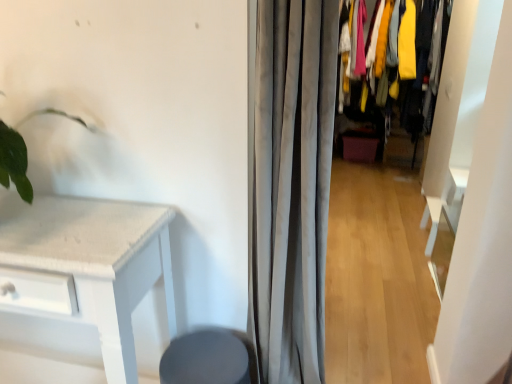
Question: Visually, is matte gray swivel chair at lower center positioned to the left or to the right of textured fabric closet at center?

Choices:
 (A) left
 (B) right

Answer: (A)

Question: In terms of size, does matte gray swivel chair at lower center appear bigger or smaller than textured fabric closet at center?

Choices:
 (A) small
 (B) big

Answer: (A)

Question: Which object is positioned closest to the gray fabric curtain at center?

Choices:
 (A) textured fabric closet at center
 (B) matte gray swivel chair at lower center

Answer: (B)

Question: Which of these objects is positioned closest to the matte gray swivel chair at lower center?

Choices:
 (A) gray fabric curtain at center
 (B) textured fabric closet at center

Answer: (A)